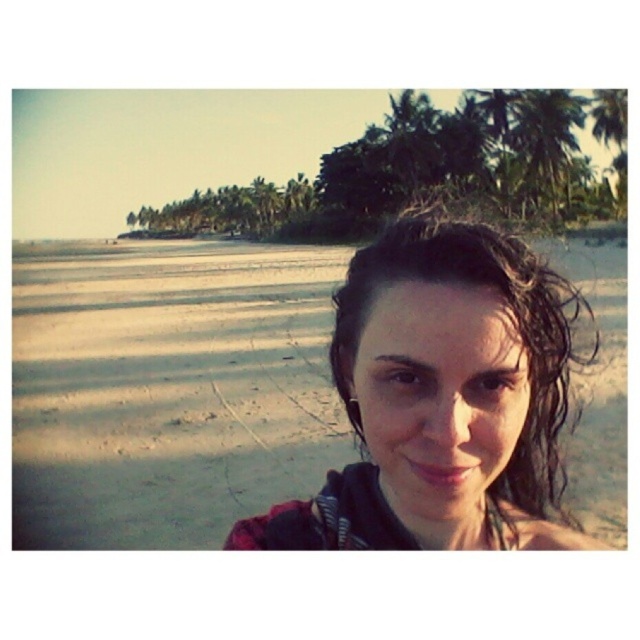
Question: Does wet hair at center appear over green leafy palm tree at upper right?

Choices:
 (A) yes
 (B) no

Answer: (B)

Question: From the image, what is the correct spatial relationship of wet hair at center in relation to green leafy palm tree at upper right?

Choices:
 (A) above
 (B) below

Answer: (B)

Question: Does wet hair at center have a lesser width compared to green leafy palm tree at upper right?

Choices:
 (A) no
 (B) yes

Answer: (A)

Question: Which point is farther to the camera?

Choices:
 (A) green leafy palm tree at upper right
 (B) wet hair at center

Answer: (A)

Question: Which point is closer to the camera?

Choices:
 (A) wet hair at center
 (B) green leafy palm tree at upper right

Answer: (A)

Question: Which point is closer to the camera?

Choices:
 (A) green leafy palm tree at upper right
 (B) wet hair at center

Answer: (B)